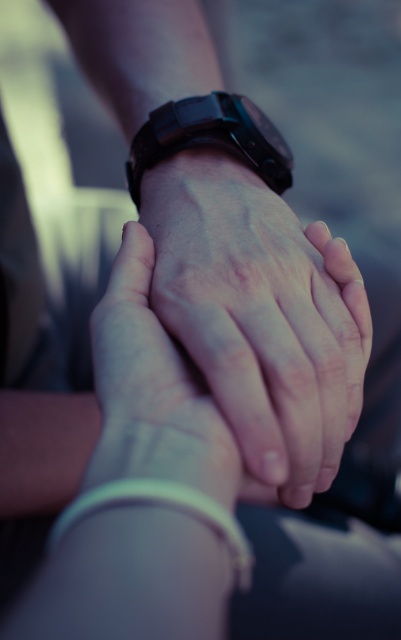
Can you confirm if black matte watch at center is positioned above white matte bracelet at lower center?

Correct, black matte watch at center is located above white matte bracelet at lower center.

The image size is (401, 640). What do you see at coordinates (210, 138) in the screenshot? I see `black matte watch at center` at bounding box center [210, 138].

Does point (251, 160) come farther from viewer compared to point (149, 504)?

That is True.

Image resolution: width=401 pixels, height=640 pixels. I want to click on black matte watch at center, so click(x=210, y=138).

The height and width of the screenshot is (640, 401). What are the coordinates of `matte black watch at center` in the screenshot? It's located at (261, 316).

Is point (289, 410) positioned before point (279, 164)?

Yes.

Does point (249, 406) come closer to viewer compared to point (137, 180)?

Yes, it is in front of point (137, 180).

The width and height of the screenshot is (401, 640). Find the location of `matte black watch at center`. matte black watch at center is located at coordinates (261, 316).

Is matte black watch at center positioned in front of white matte bracelet at lower center?

No, it is not.

Can you confirm if matte black watch at center is positioned above white matte bracelet at lower center?

Correct, matte black watch at center is located above white matte bracelet at lower center.

Where is `matte black watch at center`? The height and width of the screenshot is (640, 401). matte black watch at center is located at coordinates (261, 316).